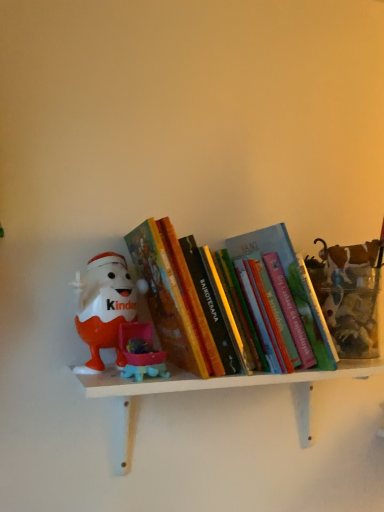
What is the approximate width of hardcover book at center?

9.32 inches.

Identify the location of hardcover book at center. (185, 300).

Between hardcover book at center and matte plastic kinder egg at left, which one has smaller size?

matte plastic kinder egg at left is smaller.

Is hardcover book at center directly adjacent to matte plastic kinder egg at left?

No, hardcover book at center is not touching matte plastic kinder egg at left.

From the image's perspective, relative to matte plastic kinder egg at left, is hardcover book at center above or below?

Based on their image positions, hardcover book at center is located above matte plastic kinder egg at left.

Is hardcover book at center facing away from matte plastic kinder egg at left?

hardcover book at center does not have its back to matte plastic kinder egg at left.

From a real-world perspective, between matte plastic kinder egg at left and hardcover book at center, who is vertically higher?

hardcover book at center is physically above.

Looking at this image, does matte plastic kinder egg at left have a greater height compared to hardcover book at center?

Incorrect, the height of matte plastic kinder egg at left is not larger of that of hardcover book at center.

Can you confirm if matte plastic kinder egg at left is positioned to the left of hardcover book at center?

Yes, matte plastic kinder egg at left is to the left of hardcover book at center.

Is white matte shelf at center touching hardcover book at center?

No, white matte shelf at center is not next to hardcover book at center.

Which of these two, white matte shelf at center or hardcover book at center, stands taller?

hardcover book at center.

From a real-world perspective, who is located lower, white matte shelf at center or hardcover book at center?

In real-world perspective, white matte shelf at center is lower.

Which is in front, matte plastic kinder egg at left or white matte shelf at center?

Positioned in front is white matte shelf at center.

Considering the sizes of matte plastic kinder egg at left and white matte shelf at center in the image, is matte plastic kinder egg at left wider or thinner than white matte shelf at center?

Clearly, matte plastic kinder egg at left has less width compared to white matte shelf at center.

Considering the points (119, 317) and (311, 428), which point is in front, point (119, 317) or point (311, 428)?

Positioned in front is point (119, 317).

Is matte plastic kinder egg at left far from white matte shelf at center?

That's not correct — matte plastic kinder egg at left is a little close to white matte shelf at center.

Looking at this image, how many degrees apart are the facing directions of white matte shelf at center and matte plastic kinder egg at left?

0.00324 degrees.

Considering the points (131, 415) and (100, 319), which point is in front, point (131, 415) or point (100, 319)?

The point (100, 319) is more forward.

Is white matte shelf at center beside matte plastic kinder egg at left?

No, white matte shelf at center is not next to matte plastic kinder egg at left.

Considering the relative sizes of white matte shelf at center and matte plastic kinder egg at left in the image provided, is white matte shelf at center bigger than matte plastic kinder egg at left?

Yes.

From the image's perspective, which object appears higher, hardcover book at center or white matte shelf at center?

From the image's view, hardcover book at center is above.

Is hardcover book at center taller than white matte shelf at center?

Yes, hardcover book at center is taller than white matte shelf at center.

How many degrees apart are the facing directions of hardcover book at center and white matte shelf at center?

hardcover book at center and white matte shelf at center are facing 0.00148 degrees away from each other.

How distant is hardcover book at center from white matte shelf at center?

hardcover book at center is 4.46 inches away from white matte shelf at center.

The height and width of the screenshot is (512, 384). I want to click on toy that is behind the hardcover book at center, so [x=105, y=307].

Find the location of `book above the matte plastic kinder egg at left (from the image's perspective)`. book above the matte plastic kinder egg at left (from the image's perspective) is located at coordinates coord(185,300).

Estimate the real-world distances between objects in this image. Which object is further from hardcover book at center, white matte shelf at center or matte plastic kinder egg at left?

white matte shelf at center lies further to hardcover book at center than the other object.

Looking at the image, which one is located closer to hardcover book at center, matte plastic kinder egg at left or white matte shelf at center?

matte plastic kinder egg at left lies closer to hardcover book at center than the other object.

Which object lies further to the anchor point matte plastic kinder egg at left, white matte shelf at center or hardcover book at center?

white matte shelf at center.

Estimate the real-world distances between objects in this image. Which object is closer to matte plastic kinder egg at left, hardcover book at center or white matte shelf at center?

hardcover book at center is positioned closer to the anchor matte plastic kinder egg at left.

Considering their positions, is hardcover book at center positioned further to white matte shelf at center than matte plastic kinder egg at left?

matte plastic kinder egg at left.

Based on their spatial positions, is matte plastic kinder egg at left or hardcover book at center closer to white matte shelf at center?

The object closer to white matte shelf at center is hardcover book at center.

At what (x,y) coordinates should I click in order to perform the action: click on toy between hardcover book at center and white matte shelf at center from top to bottom. Please return your answer as a coordinate pair (x, y). The width and height of the screenshot is (384, 512). Looking at the image, I should click on pyautogui.click(x=105, y=307).